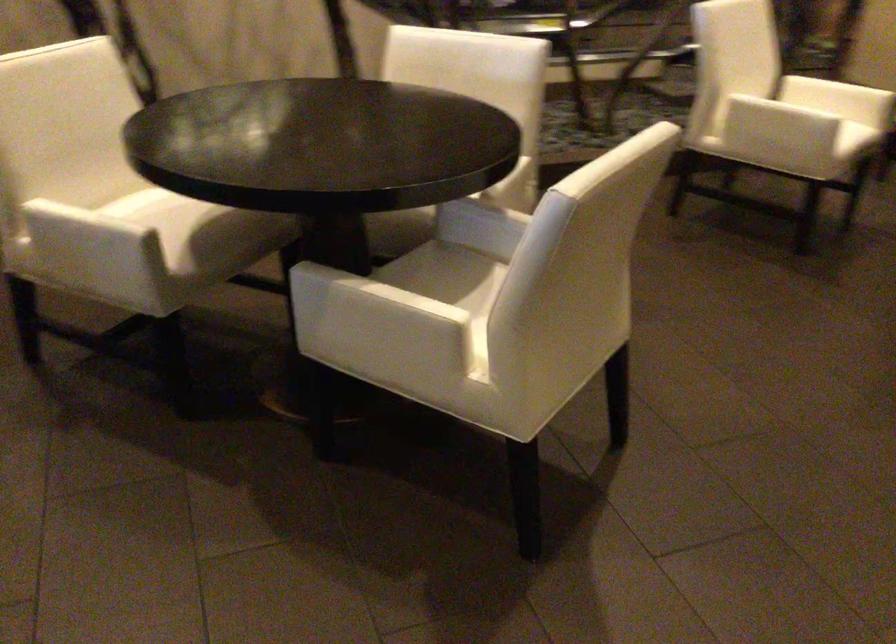
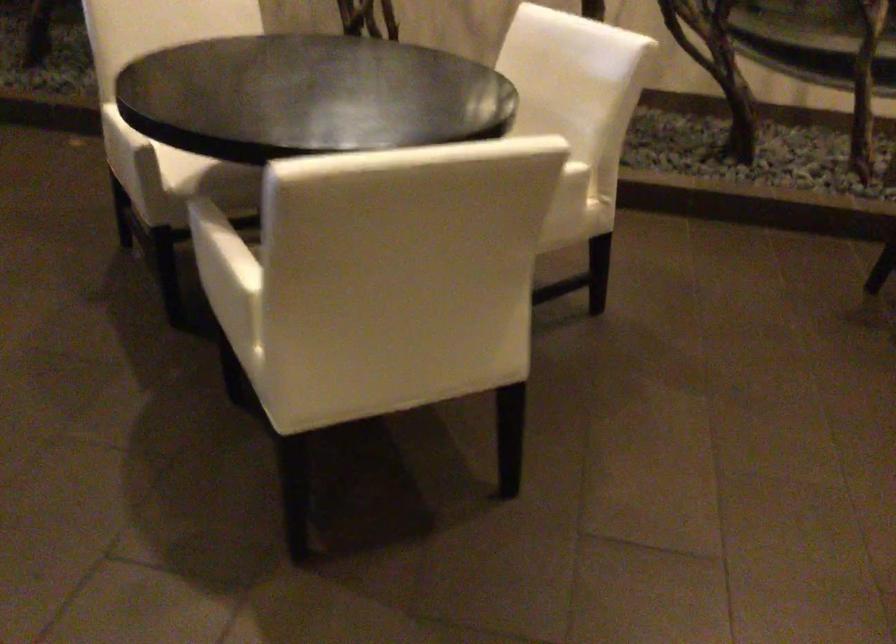
Find the pixel in the second image that matches (x=391, y=301) in the first image.

(220, 249)